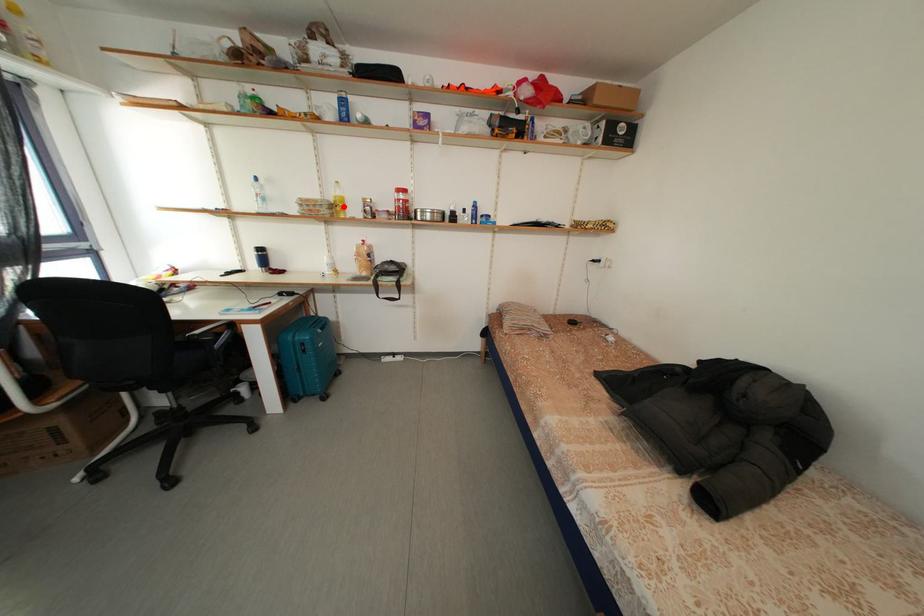
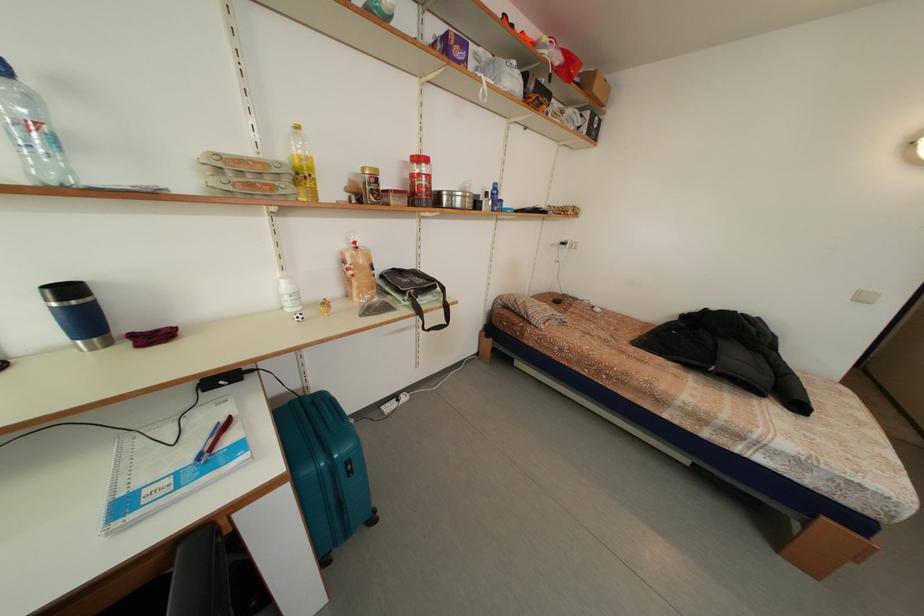
Where in the second image is the point corresponding to the highlighted location from the first image?

(310, 172)